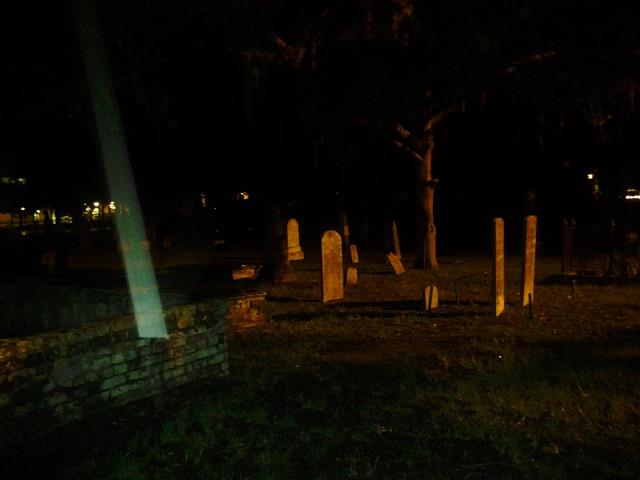
You are a GUI agent. You are given a task and a screenshot of the screen. Output one action in this format:
    pyautogui.click(x=<x>, y=<y>)
    Task: Click on the brick wall
    
    Given the screenshot: What is the action you would take?
    pyautogui.click(x=96, y=368), pyautogui.click(x=86, y=307)